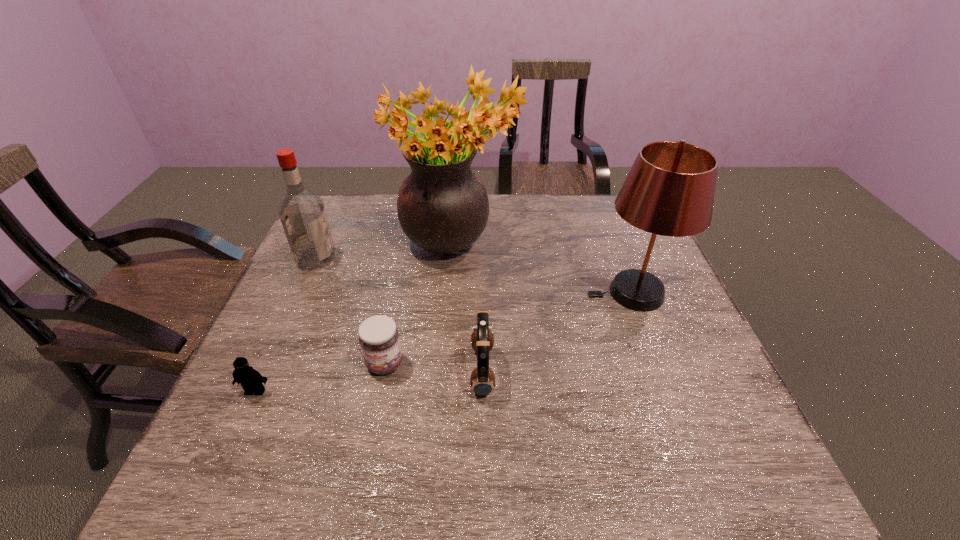
This screenshot has width=960, height=540. Find the location of `flower arrangement`. flower arrangement is located at coordinates (442, 206).

Identify the location of the rightmost object. (669, 191).

This screenshot has width=960, height=540. In order to click on the third tallest object in this screenshot , I will do `click(302, 213)`.

Find the location of a particular element. The width and height of the screenshot is (960, 540). the third shortest object is located at coordinates (482, 381).

The image size is (960, 540). I want to click on jam, so click(x=378, y=336).

Locate an element on the screen. This screenshot has height=540, width=960. Lego is located at coordinates (251, 380).

The image size is (960, 540). Find the location of `vacant space located 0.250m on the front of the flower arrangement`. vacant space located 0.250m on the front of the flower arrangement is located at coordinates (450, 359).

At what (x,y) coordinates should I click in order to perform the action: click on vacant space situated 0.380m on the front-facing side of the rightmost object. Please return your answer as a coordinate pair (x, y). This screenshot has width=960, height=540. Looking at the image, I should click on (443, 293).

You are a GUI agent. You are given a task and a screenshot of the screen. Output one action in this format:
    pyautogui.click(x=<x>, y=<y>)
    Task: Click on the blank area located on the front-facing side of the rightmost object
    
    Given the screenshot: What is the action you would take?
    pyautogui.click(x=507, y=293)

I want to click on vacant space situated on the front-facing side of the rightmost object, so click(x=561, y=293).